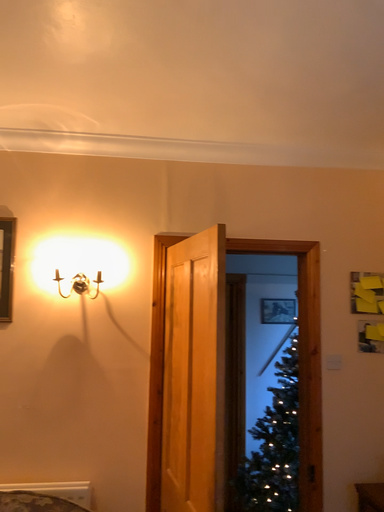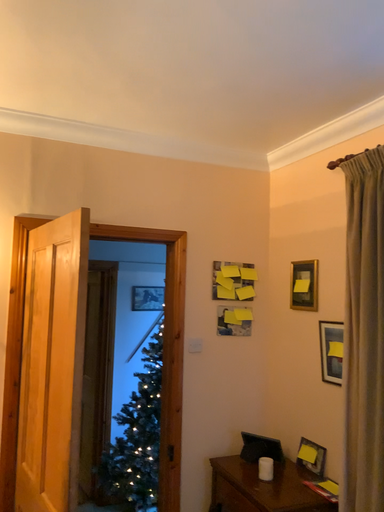
Question: Which way did the camera rotate in the video?

Choices:
 (A) rotated right
 (B) rotated left

Answer: (A)